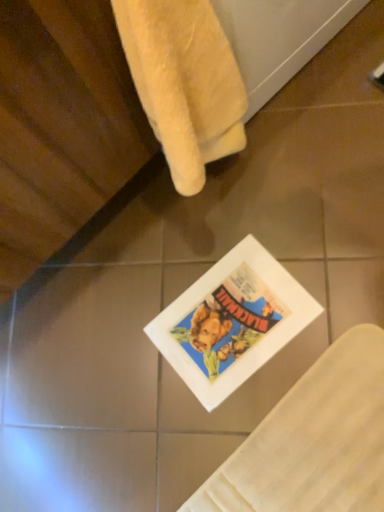
Question: From the image's perspective, is soft yellow towel at upper left positioned above or below matte paper comic book at center?

Choices:
 (A) above
 (B) below

Answer: (A)

Question: Based on their positions, is soft yellow towel at upper left located to the left or right of matte paper comic book at center?

Choices:
 (A) right
 (B) left

Answer: (B)

Question: Which is correct: soft yellow towel at upper left is inside matte paper comic book at center, or outside of it?

Choices:
 (A) inside
 (B) outside

Answer: (B)

Question: From the image's perspective, is matte paper comic book at center positioned above or below soft yellow towel at upper left?

Choices:
 (A) above
 (B) below

Answer: (B)

Question: Looking at their shapes, would you say matte paper comic book at center is wider or thinner than soft yellow towel at upper left?

Choices:
 (A) wide
 (B) thin

Answer: (A)

Question: From a real-world perspective, is matte paper comic book at center above or below soft yellow towel at upper left?

Choices:
 (A) above
 (B) below

Answer: (B)

Question: In the image, is matte paper comic book at center positioned in front of or behind soft yellow towel at upper left?

Choices:
 (A) front
 (B) behind

Answer: (B)